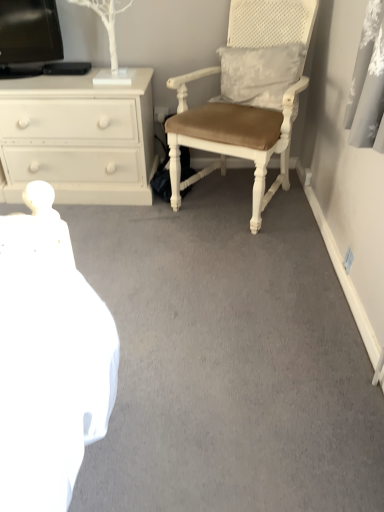
Identify the location of vacant area that is in front of white wood chair at right. (233, 255).